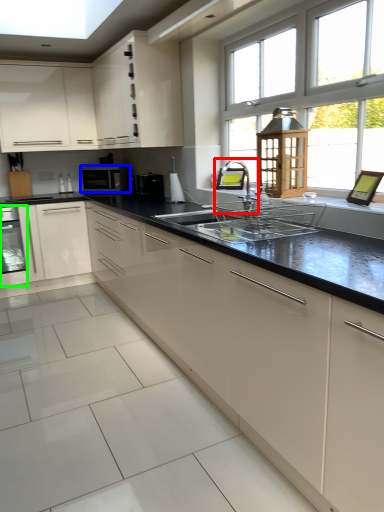
Question: Which object is the closest to the faucet (highlighted by a red box)? Choose among these: kitchen appliance (highlighted by a blue box) or home appliance (highlighted by a green box).

Choices:
 (A) kitchen appliance
 (B) home appliance

Answer: (A)